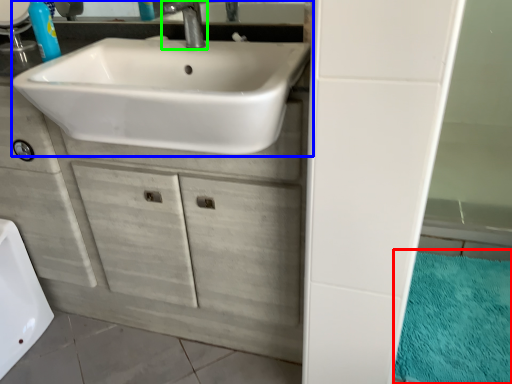
Question: Which object is positioned farthest from bath mat (highlighted by a red box)? Select from sink (highlighted by a blue box) and tap (highlighted by a green box).

Choices:
 (A) sink
 (B) tap

Answer: (B)